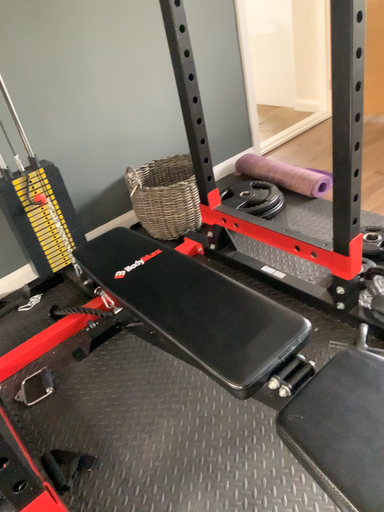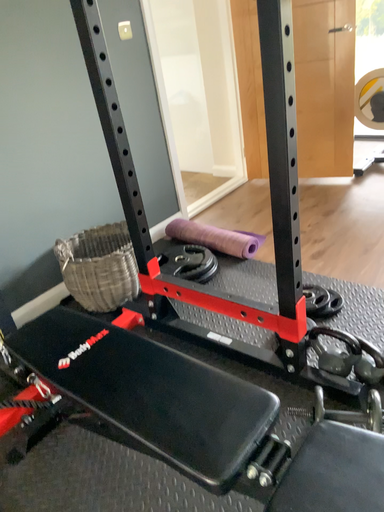
Question: How did the camera likely rotate when shooting the video?

Choices:
 (A) rotated upward
 (B) rotated downward

Answer: (A)